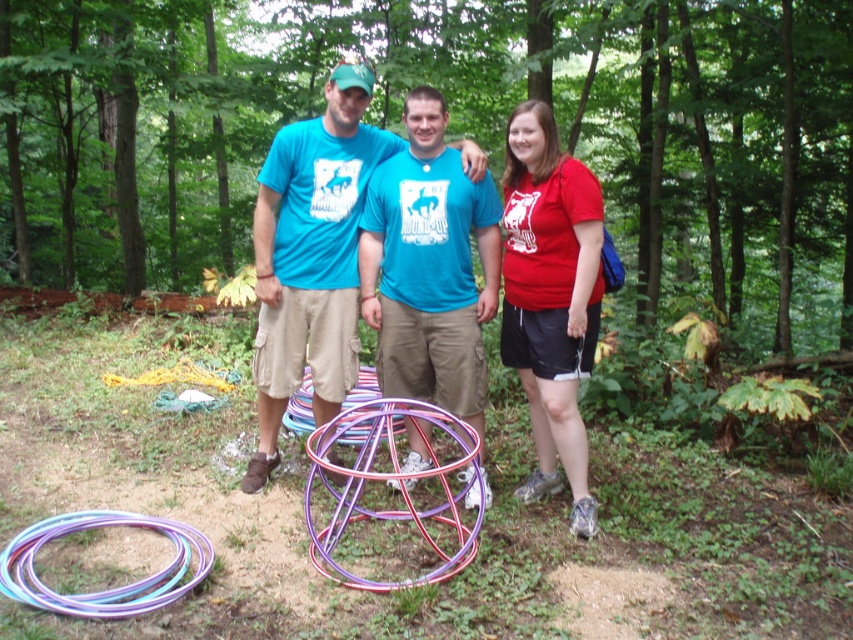
Can you confirm if metallic multicolored hula hoop at center is wider than multicolored plastic hula hoop at lower left?

Correct, the width of metallic multicolored hula hoop at center exceeds that of multicolored plastic hula hoop at lower left.

Can you confirm if metallic multicolored hula hoop at center is positioned to the left of multicolored plastic hula hoop at lower left?

In fact, metallic multicolored hula hoop at center is to the right of multicolored plastic hula hoop at lower left.

I want to click on metallic multicolored hula hoop at center, so click(x=398, y=490).

Does point (448, 401) lie behind point (456, 435)?

Yes, it is.

Based on the photo, who is positioned more to the left, matte blue t-shirt at center or metallic multicolored hula hoop at center?

metallic multicolored hula hoop at center

Between point (476, 204) and point (367, 416), which one is positioned behind?

Positioned behind is point (476, 204).

The height and width of the screenshot is (640, 853). Identify the location of matte blue t-shirt at center. (428, 268).

Between point (521, 152) and point (409, 474), which one is positioned behind?

The point (521, 152) is behind.

Does point (520, 336) come farther from viewer compared to point (347, 524)?

Yes.

Locate an element on the screen. The height and width of the screenshot is (640, 853). matte red t-shirt at right is located at coordinates (550, 298).

You are a GUI agent. You are given a task and a screenshot of the screen. Output one action in this format:
    pyautogui.click(x=<x>, y=<y>)
    Task: Click on the matte red t-shirt at right
    This screenshot has height=640, width=853.
    Given the screenshot: What is the action you would take?
    pyautogui.click(x=550, y=298)